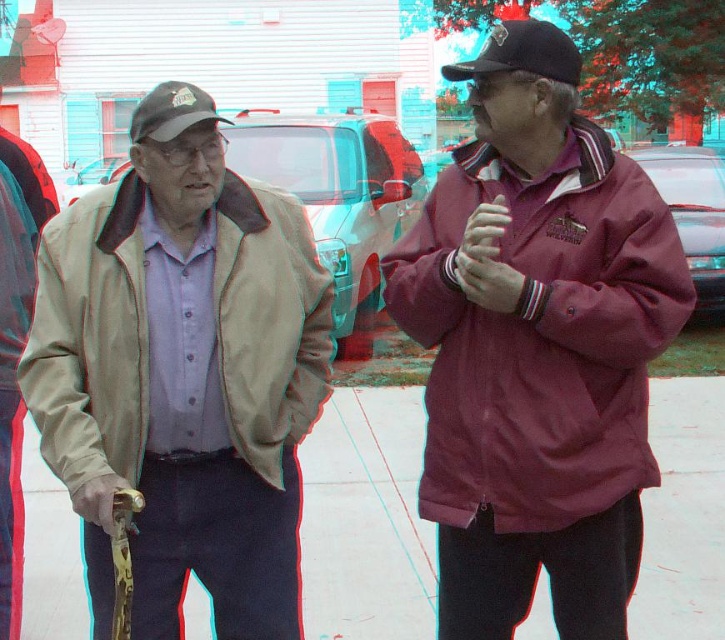
Question: Which object is farther from the camera taking this photo?

Choices:
 (A) maroon fabric jacket at right
 (B) beige leather jacket at left
 (C) matte brown baseball cap at upper left
 (D) black matte baseball cap at upper right

Answer: (C)

Question: Is beige leather jacket at left above matte brown baseball cap at upper left?

Choices:
 (A) no
 (B) yes

Answer: (A)

Question: Estimate the real-world distances between objects in this image. Which object is farther from the matte brown baseball cap at upper left?

Choices:
 (A) black matte baseball cap at upper right
 (B) white concrete pavement at center

Answer: (B)

Question: Where is black matte baseball cap at upper right located in relation to matte brown baseball cap at upper left in the image?

Choices:
 (A) below
 (B) above

Answer: (B)

Question: Based on their relative distances, which object is nearer to the matte brown baseball cap at upper left?

Choices:
 (A) beige leather jacket at left
 (B) maroon fabric jacket at right

Answer: (A)

Question: Does white concrete pavement at center lie behind matte brown baseball cap at upper left?

Choices:
 (A) no
 (B) yes

Answer: (B)